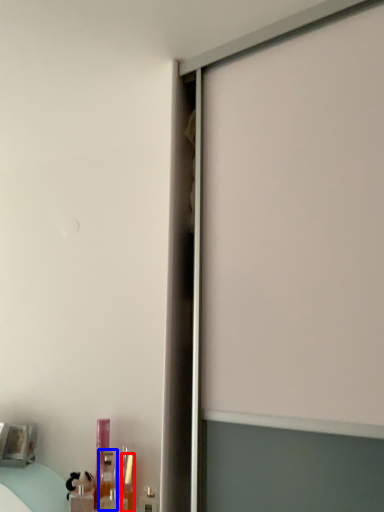
Question: Which object is closer to the camera taking this photo, toiletry (highlighted by a red box) or toiletry (highlighted by a blue box)?

Choices:
 (A) toiletry
 (B) toiletry

Answer: (A)